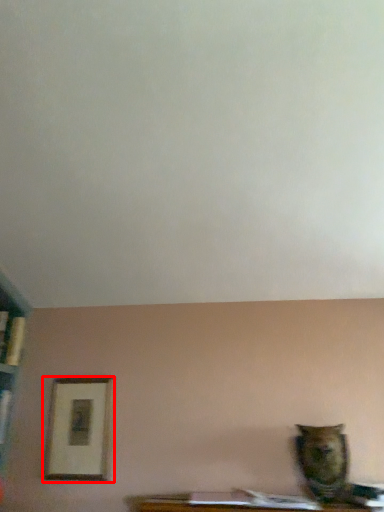
Question: From the image's perspective, where is picture frame (annotated by the red box) located relative to animal?

Choices:
 (A) above
 (B) below

Answer: (A)